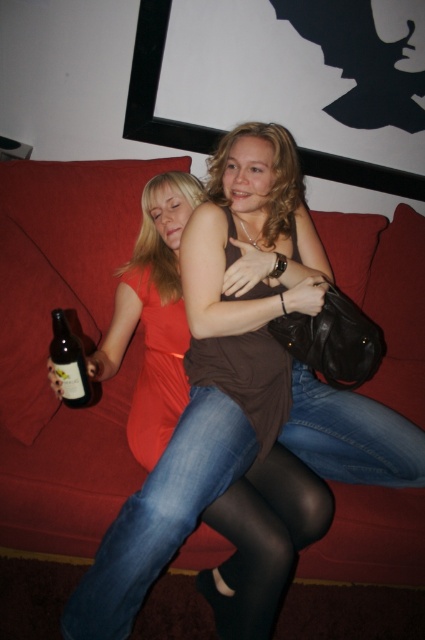
Which of these two, jeans at lower right or translucent glass bottle at lower left, stands taller?

jeans at lower right is taller.

Is jeans at lower right behind translucent glass bottle at lower left?

Yes, jeans at lower right is further from the viewer.

Is point (339, 426) positioned behind point (65, 356)?

Yes, point (339, 426) is farther from viewer.

At what (x,y) coordinates should I click in order to perform the action: click on jeans at lower right. Please return your answer as a coordinate pair (x, y). This screenshot has width=425, height=640. Looking at the image, I should click on (351, 435).

Is red fabric couch at center to the left of jeans at center from the viewer's perspective?

Yes, red fabric couch at center is to the left of jeans at center.

From the picture: Who is more forward, (87, 525) or (240, 442)?

Point (240, 442)

Does point (408, 326) come farther from viewer compared to point (133, 506)?

Yes, point (408, 326) is farther from viewer.

Image resolution: width=425 pixels, height=640 pixels. I want to click on red fabric couch at center, so click(x=50, y=339).

Which is more to the left, jeans at center or translucent glass bottle at lower left?

From the viewer's perspective, translucent glass bottle at lower left appears more on the left side.

From the picture: Does jeans at center have a lesser height compared to translucent glass bottle at lower left?

No, jeans at center is not shorter than translucent glass bottle at lower left.

At what (x,y) coordinates should I click in order to perform the action: click on jeans at center. Please return your answer as a coordinate pair (x, y). This screenshot has height=640, width=425. Looking at the image, I should click on (161, 515).